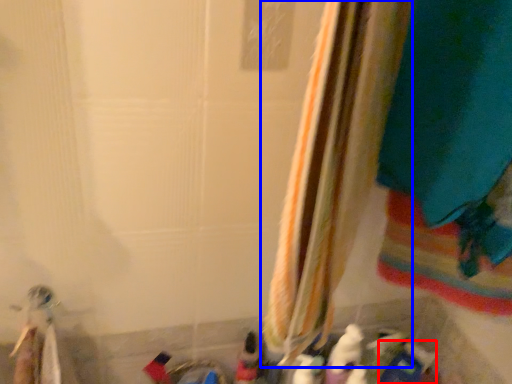
Question: Which of the following is the farthest to the observer, toy (highlighted by a red box) or curtain (highlighted by a blue box)?

Choices:
 (A) toy
 (B) curtain

Answer: (A)